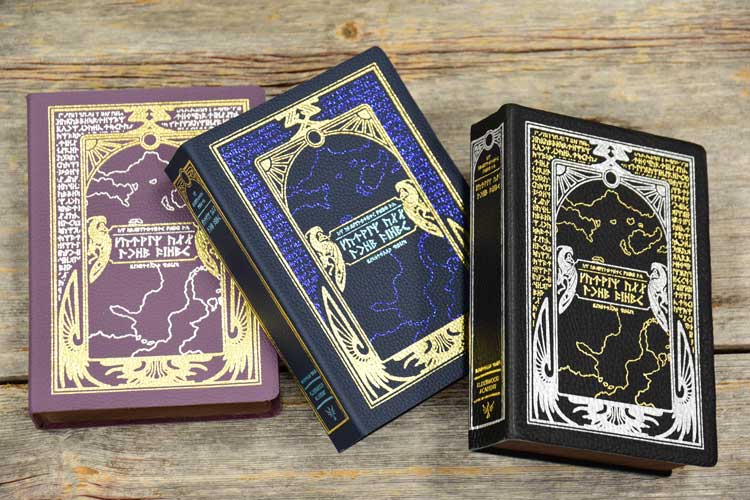
Identify the location of blue book is positioned slightly on the magenta one. This screenshot has height=500, width=750. (274, 268), (202, 302).